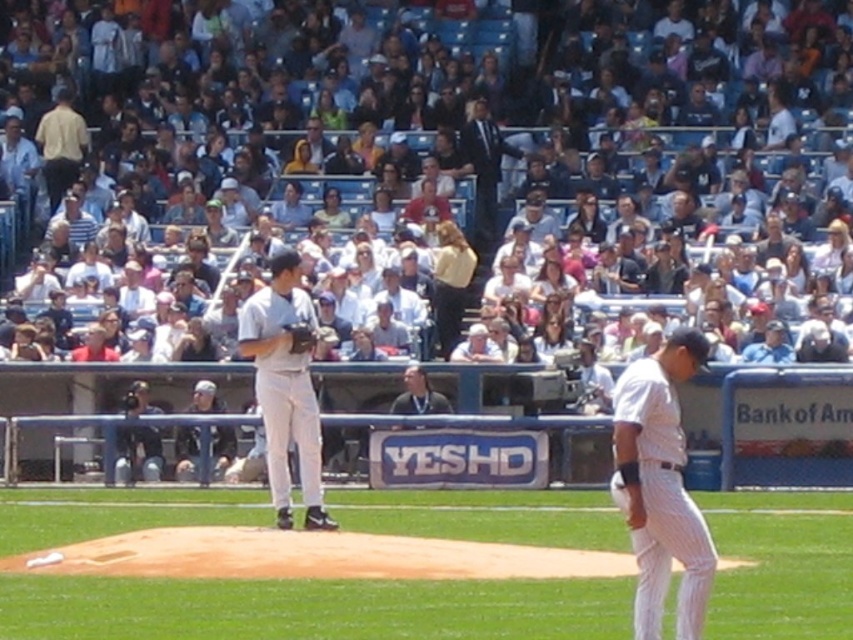
Question: In this image, where is green grass field at center located relative to white pinstriped uniform at center?

Choices:
 (A) above
 (B) below

Answer: (B)

Question: Which point appears farthest from the camera in this image?

Choices:
 (A) (224, 456)
 (B) (537, 170)
 (C) (64, 99)
 (D) (270, 282)

Answer: (C)

Question: Which point is closer to the camera?

Choices:
 (A) dark gray shirt at center
 (B) dark brown leather glove at center
 (C) white uniformed man at center
 (D) white pinstriped uniform at center

Answer: (D)

Question: Does white cotton crowd at upper center have a lesser width compared to green grass field at center?

Choices:
 (A) yes
 (B) no

Answer: (B)

Question: Which point is farther to the camera?

Choices:
 (A) (427, 401)
 (B) (202, 381)
 (C) (316, 26)
 (D) (637, 372)

Answer: (C)

Question: Does white cotton crowd at upper center appear on the right side of white uniform at center?

Choices:
 (A) yes
 (B) no

Answer: (A)